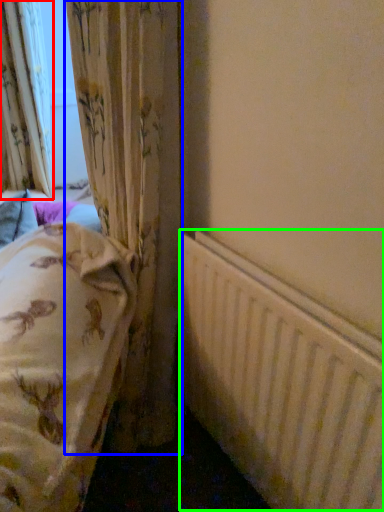
Question: Considering the real-world distances, which object is closest to curtain (highlighted by a red box)? curtain (highlighted by a blue box) or radiator (highlighted by a green box).

Choices:
 (A) curtain
 (B) radiator

Answer: (A)